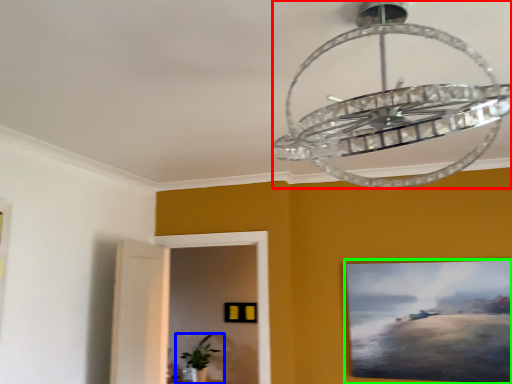
Question: Which object is the farthest from lamp (highlighted by a red box)? Choose among these: houseplant (highlighted by a blue box) or picture frame (highlighted by a green box).

Choices:
 (A) houseplant
 (B) picture frame

Answer: (A)